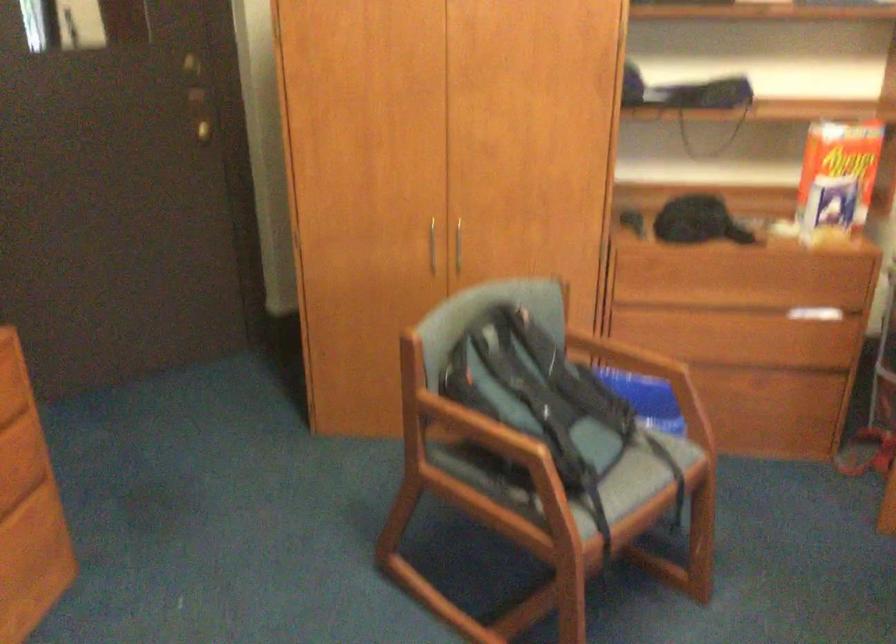
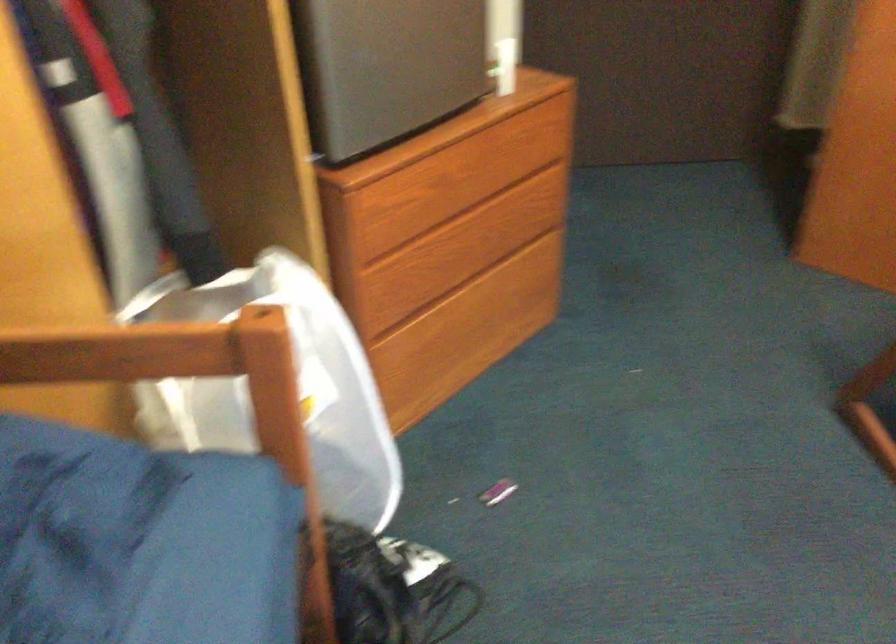
How did the camera likely rotate?

The camera's rotation is toward left-down.